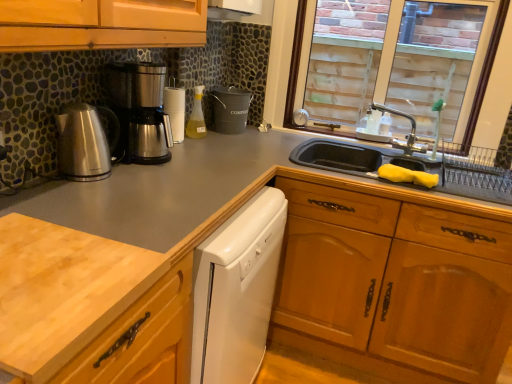
Based on the photo, what is the approximate height of brushed metal kettle at left, marked as the second kitchen appliance in a back-to-front arrangement?

brushed metal kettle at left, marked as the second kitchen appliance in a back-to-front arrangement, is 9.02 inches in height.

The height and width of the screenshot is (384, 512). I want to click on light wood cutting board at lower left, so click(90, 307).

What do you see at coordinates (230, 109) in the screenshot?
I see `matte black bucket at center` at bounding box center [230, 109].

At what (x,y) coordinates should I click in order to perform the action: click on clear glass window at upper right. Please return your answer as a coordinate pair (x, y). This screenshot has height=384, width=512. Looking at the image, I should click on (496, 83).

The width and height of the screenshot is (512, 384). What do you see at coordinates (196, 116) in the screenshot?
I see `translucent plastic bottle at center` at bounding box center [196, 116].

Where is `brushed metal kettle at left, positioned as the 1th kitchen appliance in front-to-back order`? brushed metal kettle at left, positioned as the 1th kitchen appliance in front-to-back order is located at coordinates (85, 142).

Is silver metallic faucet at upper right at the back of clear glass window at upper right?

Yes, clear glass window at upper right is positioned with its back facing silver metallic faucet at upper right.

Is point (293, 43) farther from camera compared to point (411, 125)?

That is False.

Considering the relative sizes of clear glass window at upper right and silver metallic faucet at upper right in the image provided, is clear glass window at upper right wider than silver metallic faucet at upper right?

No, clear glass window at upper right is not wider than silver metallic faucet at upper right.

Is the position of clear glass window at upper right more distant than that of silver metallic faucet at upper right?

No, the depth of clear glass window at upper right is less than that of silver metallic faucet at upper right.

Could brushed metal kettle at left, marked as the second kitchen appliance in a back-to-front arrangement, be considered to be inside stainless steel coffee maker at left, the second kitchen appliance viewed from the front?

No, brushed metal kettle at left, marked as the second kitchen appliance in a back-to-front arrangement, is not a part of stainless steel coffee maker at left, the second kitchen appliance viewed from the front.

Is stainless steel coffee maker at left, acting as the first kitchen appliance starting from the back, at the right side of brushed metal kettle at left, marked as the second kitchen appliance in a back-to-front arrangement?

Yes, stainless steel coffee maker at left, acting as the first kitchen appliance starting from the back, is to the right of brushed metal kettle at left, marked as the second kitchen appliance in a back-to-front arrangement.

Is there a large distance between stainless steel coffee maker at left, acting as the first kitchen appliance starting from the back, and brushed metal kettle at left, positioned as the 1th kitchen appliance in front-to-back order?

stainless steel coffee maker at left, acting as the first kitchen appliance starting from the back, is near brushed metal kettle at left, positioned as the 1th kitchen appliance in front-to-back order, not far away.

From the image's perspective, is stainless steel coffee maker at left, the second kitchen appliance viewed from the front, above or below brushed metal kettle at left, marked as the second kitchen appliance in a back-to-front arrangement?

stainless steel coffee maker at left, the second kitchen appliance viewed from the front, is situated higher than brushed metal kettle at left, marked as the second kitchen appliance in a back-to-front arrangement, in the image.

Is stainless steel coffee maker at left, the second kitchen appliance viewed from the front, at the right side of clear glass window at upper right?

No.

Does stainless steel coffee maker at left, acting as the first kitchen appliance starting from the back, come in front of clear glass window at upper right?

Yes, stainless steel coffee maker at left, acting as the first kitchen appliance starting from the back, is in front of clear glass window at upper right.

Which is closer, (152,110) or (492,142)?

The point (152,110) is closer to the camera.

Would you consider stainless steel coffee maker at left, acting as the first kitchen appliance starting from the back, to be distant from clear glass window at upper right?

No, stainless steel coffee maker at left, acting as the first kitchen appliance starting from the back, is not far from clear glass window at upper right.

Is wooden drawer at lower right not close to matte black bucket at center?

That's not correct — wooden drawer at lower right is a little close to matte black bucket at center.

In the scene shown: In terms of width, does wooden drawer at lower right look wider or thinner when compared to matte black bucket at center?

Considering their sizes, wooden drawer at lower right looks broader than matte black bucket at center.

In the scene shown: Considering the positions of objects wooden drawer at lower right and matte black bucket at center in the image provided, who is behind, wooden drawer at lower right or matte black bucket at center?

matte black bucket at center is behind.

Measure the distance between wooden drawer at lower right and matte black bucket at center.

29.68 inches.

Can you confirm if light wood cutting board at lower left is positioned to the left of matte black bucket at center?

Yes.

Who is smaller, light wood cutting board at lower left or matte black bucket at center?

matte black bucket at center is smaller.

Which object is closer to the camera taking this photo, light wood cutting board at lower left or matte black bucket at center?

light wood cutting board at lower left.

In the scene shown: Is light wood cutting board at lower left spatially inside matte black bucket at center, or outside of it?

The correct answer is: outside.

Is translucent plastic bottle at center taller or shorter than brushed metal kettle at left, positioned as the 1th kitchen appliance in front-to-back order?

translucent plastic bottle at center is taller than brushed metal kettle at left, positioned as the 1th kitchen appliance in front-to-back order.

From the image's perspective, would you say translucent plastic bottle at center is shown under brushed metal kettle at left, positioned as the 1th kitchen appliance in front-to-back order?

Actually, translucent plastic bottle at center appears above brushed metal kettle at left, positioned as the 1th kitchen appliance in front-to-back order, in the image.

What's the angular difference between translucent plastic bottle at center and brushed metal kettle at left, marked as the second kitchen appliance in a back-to-front arrangement,'s facing directions?

They differ by 0.00169 degrees in their facing directions.

Is stainless steel coffee maker at left, acting as the first kitchen appliance starting from the back, outside of silver metallic faucet at upper right?

stainless steel coffee maker at left, acting as the first kitchen appliance starting from the back, is positioned outside silver metallic faucet at upper right.

Looking at this image, from the image's perspective, which one is positioned lower, stainless steel coffee maker at left, acting as the first kitchen appliance starting from the back, or silver metallic faucet at upper right?

silver metallic faucet at upper right is shown below in the image.

Does stainless steel coffee maker at left, the second kitchen appliance viewed from the front, have a greater height compared to silver metallic faucet at upper right?

Yes, stainless steel coffee maker at left, the second kitchen appliance viewed from the front, is taller than silver metallic faucet at upper right.

The height and width of the screenshot is (384, 512). I want to click on tap below the clear glass window at upper right (from a real-world perspective), so click(x=407, y=135).

Where is `kitchen appliance in front of the stainless steel coffee maker at left, acting as the first kitchen appliance starting from the back`? Image resolution: width=512 pixels, height=384 pixels. kitchen appliance in front of the stainless steel coffee maker at left, acting as the first kitchen appliance starting from the back is located at coordinates (85, 142).

Which object lies nearer to the anchor point matte black bucket at center, light wood cutting board at lower left or white glossy dishwasher at center?

white glossy dishwasher at center is positioned closer to the anchor matte black bucket at center.

Consider the image. From the image, which object appears to be farther from silver metallic faucet at upper right, translucent plastic bottle at center or matte black bucket at center?

translucent plastic bottle at center is further to silver metallic faucet at upper right.

Estimate the real-world distances between objects in this image. Which object is closer to white glossy dishwasher at center, brushed metal kettle at left, positioned as the 1th kitchen appliance in front-to-back order, or clear glass window at upper right?

brushed metal kettle at left, positioned as the 1th kitchen appliance in front-to-back order.

Based on their spatial positions, is light wood cutting board at lower left or stainless steel coffee maker at left, the second kitchen appliance viewed from the front, further from white glossy dishwasher at center?

stainless steel coffee maker at left, the second kitchen appliance viewed from the front, lies further to white glossy dishwasher at center than the other object.

Looking at the image, which one is located further to light wood cutting board at lower left, brushed metal kettle at left, marked as the second kitchen appliance in a back-to-front arrangement, or matte black bucket at center?

Based on the image, matte black bucket at center appears to be further to light wood cutting board at lower left.

Considering their positions, is silver metallic faucet at upper right positioned further to brushed metal kettle at left, marked as the second kitchen appliance in a back-to-front arrangement, than light wood cutting board at lower left?

Among the two, silver metallic faucet at upper right is located further to brushed metal kettle at left, marked as the second kitchen appliance in a back-to-front arrangement.

When comparing their distances from stainless steel coffee maker at left, acting as the first kitchen appliance starting from the back, does brushed metal kettle at left, marked as the second kitchen appliance in a back-to-front arrangement, or white glossy dishwasher at center seem closer?

Based on the image, brushed metal kettle at left, marked as the second kitchen appliance in a back-to-front arrangement, appears to be nearer to stainless steel coffee maker at left, acting as the first kitchen appliance starting from the back.

Which object lies further to the anchor point translucent plastic bottle at center, light wood cutting board at lower left or white glossy dishwasher at center?

light wood cutting board at lower left.

Identify the location of drawer that lies between silver metallic faucet at upper right and white glossy dishwasher at center from top to bottom. The width and height of the screenshot is (512, 384). (400, 220).

You are a GUI agent. You are given a task and a screenshot of the screen. Output one action in this format:
    pyautogui.click(x=<x>, y=<y>)
    Task: Click on the window positioned between light wood cutting board at lower left and silver metallic faucet at upper right from near to far
    
    Given the screenshot: What is the action you would take?
    pyautogui.click(x=496, y=83)

The height and width of the screenshot is (384, 512). Identify the location of cabinetry between light wood cutting board at lower left and translucent plastic bottle at center in the front-back direction. tap(278, 276).

The width and height of the screenshot is (512, 384). I want to click on cabinetry between stainless steel coffee maker at left, acting as the first kitchen appliance starting from the back, and wooden drawer at lower right, in the horizontal direction, so click(278, 276).